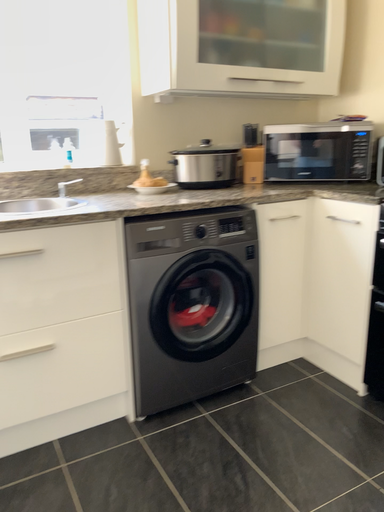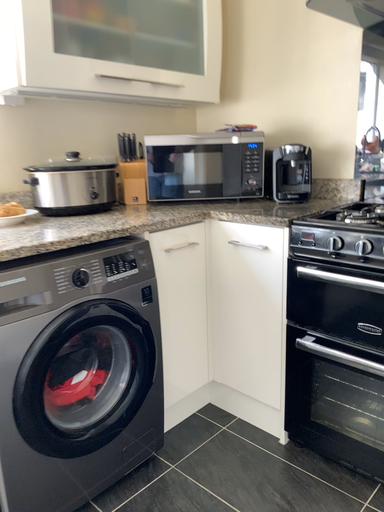
Question: How did the camera likely rotate when shooting the video?

Choices:
 (A) rotated right
 (B) rotated left

Answer: (A)